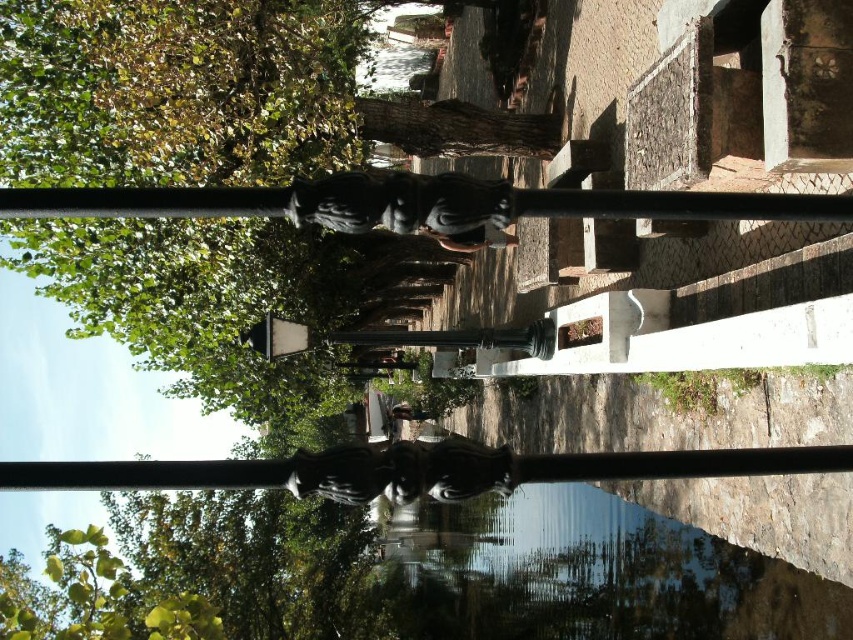
Is glossy reflective puddle at lower center positioned at the back of glossy black statue at center?

Yes, it is.

Is glossy reflective puddle at lower center smaller than glossy black statue at center?

Incorrect, glossy reflective puddle at lower center is not smaller in size than glossy black statue at center.

Is point (663, 576) positioned before point (453, 476)?

No, (663, 576) is further to viewer.

What are the coordinates of `glossy reflective puddle at lower center` in the screenshot? It's located at (595, 573).

Who is lower down, green leafy tree at upper left or glossy reflective puddle at lower center?

glossy reflective puddle at lower center is lower down.

Which of these two, green leafy tree at upper left or glossy reflective puddle at lower center, stands shorter?

glossy reflective puddle at lower center is shorter.

The image size is (853, 640). What are the coordinates of `green leafy tree at upper left` in the screenshot? It's located at (177, 90).

The image size is (853, 640). I want to click on green leafy tree at upper left, so click(x=177, y=90).

In the scene shown: Does green leafy tree at upper left have a smaller size compared to glossy black statue at center?

Actually, green leafy tree at upper left might be larger than glossy black statue at center.

Is green leafy tree at upper left thinner than glossy black statue at center?

No.

Who is more distant from viewer, (x=247, y=356) or (x=346, y=465)?

Point (x=247, y=356)

You are a GUI agent. You are given a task and a screenshot of the screen. Output one action in this format:
    pyautogui.click(x=<x>, y=<y>)
    Task: Click on the green leafy tree at upper left
    This screenshot has height=640, width=853.
    Given the screenshot: What is the action you would take?
    pyautogui.click(x=177, y=90)